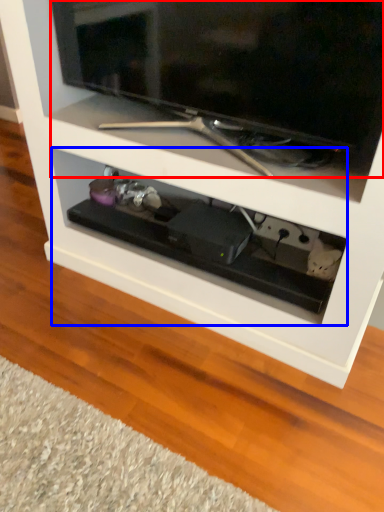
Question: Which object appears farthest to the camera in this image, television (highlighted by a red box) or drawer (highlighted by a blue box)?

Choices:
 (A) television
 (B) drawer

Answer: (B)